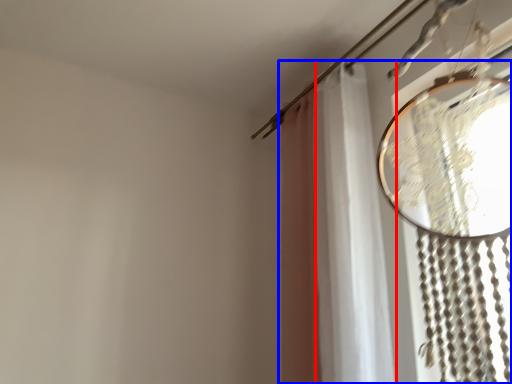
Question: Which object appears farthest to the camera in this image, shower curtain (highlighted by a red box) or curtain (highlighted by a blue box)?

Choices:
 (A) shower curtain
 (B) curtain

Answer: (A)